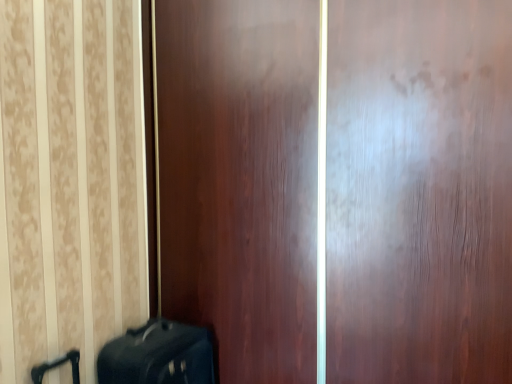
The image size is (512, 384). What do you see at coordinates (158, 355) in the screenshot? I see `matte black suitcase at lower left` at bounding box center [158, 355].

In order to click on matte black suitcase at lower left in this screenshot , I will do `click(158, 355)`.

Locate an element on the screen. The height and width of the screenshot is (384, 512). matte black suitcase at lower left is located at coordinates (158, 355).